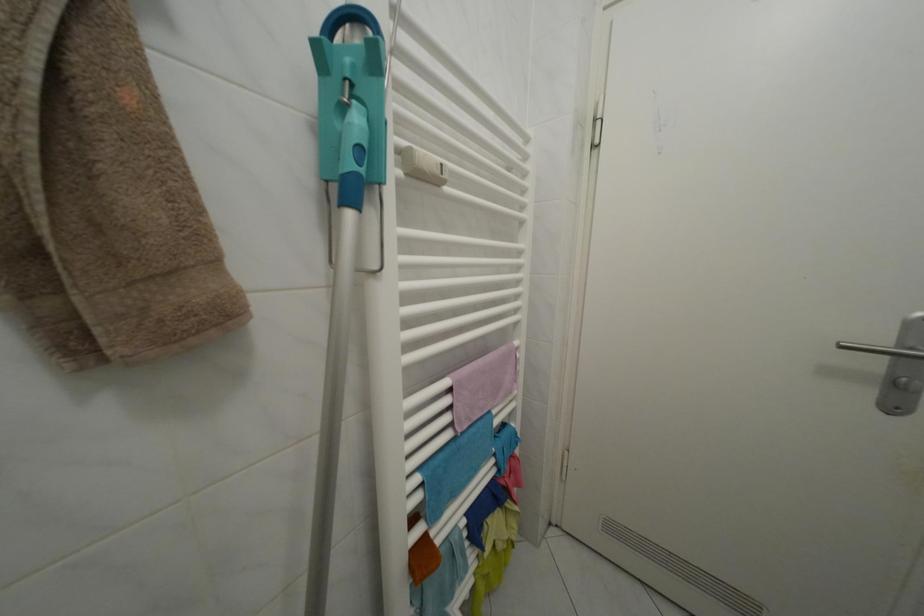
Describe the element at coordinates (456, 466) in the screenshot. The image size is (924, 616). I see `the light blue cloth` at that location.